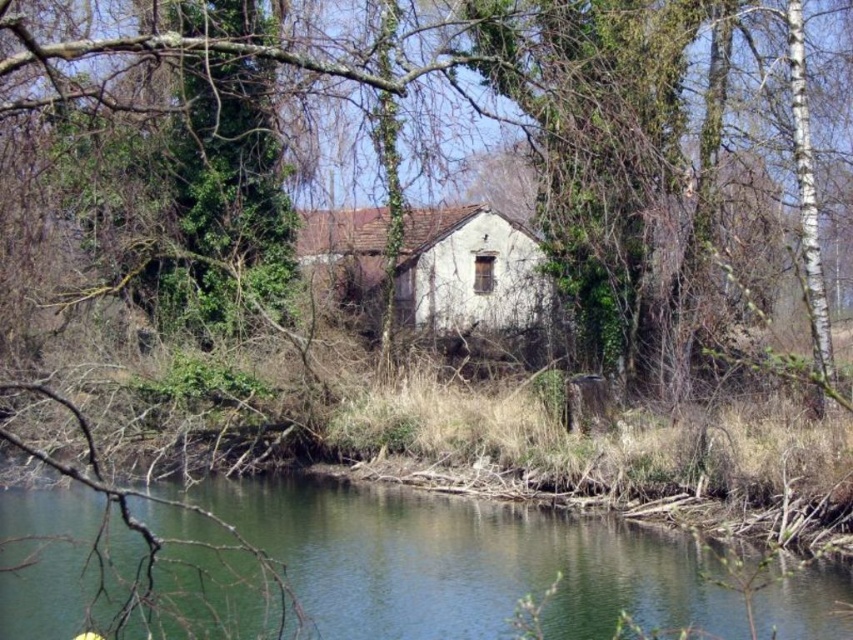
Question: Estimate the real-world distances between objects in this image. Which object is closer to the green water at lower center?

Choices:
 (A) white rough wooden hut at center
 (B) green ivy-covered tree at center

Answer: (B)

Question: Which point is closer to the camera taking this photo?

Choices:
 (A) (811, 380)
 (B) (323, 225)

Answer: (A)

Question: Is green water at lower center to the right of white rough wooden hut at center from the viewer's perspective?

Choices:
 (A) yes
 (B) no

Answer: (B)

Question: Which object is positioned closest to the green ivy-covered tree at center?

Choices:
 (A) white rough wooden hut at center
 (B) green water at lower center

Answer: (B)

Question: Can you confirm if green water at lower center is thinner than white rough wooden hut at center?

Choices:
 (A) no
 (B) yes

Answer: (A)

Question: Does white rough wooden hut at center have a smaller size compared to green ivy-covered tree at center?

Choices:
 (A) no
 (B) yes

Answer: (B)